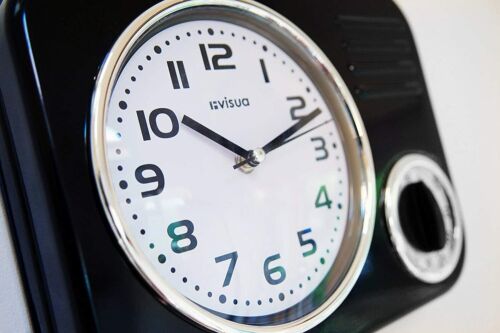
The image size is (500, 333). Find the location of `frame`. frame is located at coordinates (351, 275).